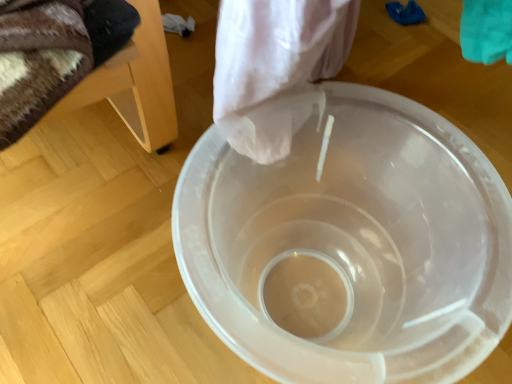
Where is `free point below wooden chair at left (from a real-world perspective)`? free point below wooden chair at left (from a real-world perspective) is located at coordinates (92, 190).